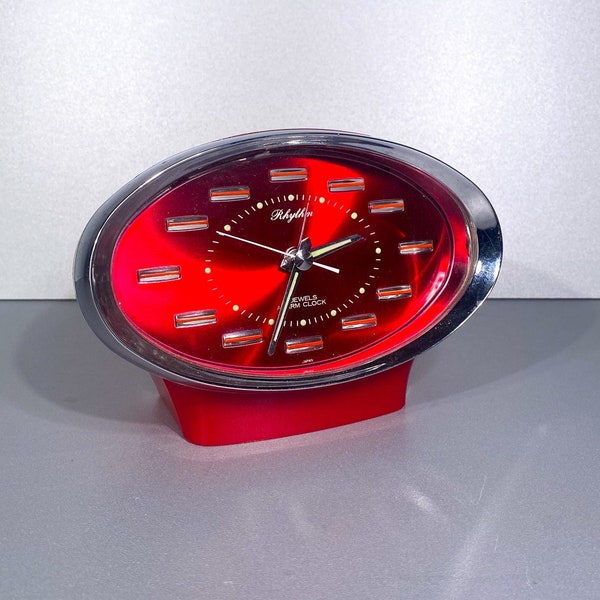
Locate an element on the screen. silver border of clock is located at coordinates (110, 323).